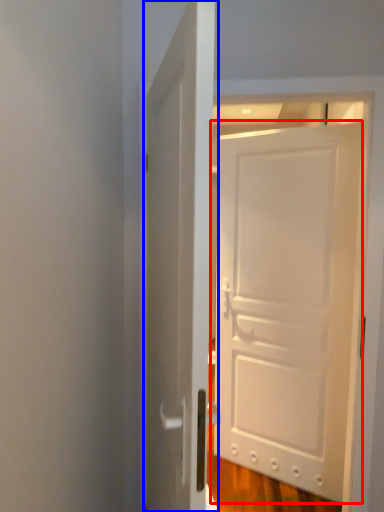
Question: Which point is closer to the camera, door (highlighted by a red box) or door (highlighted by a blue box)?

Choices:
 (A) door
 (B) door

Answer: (B)